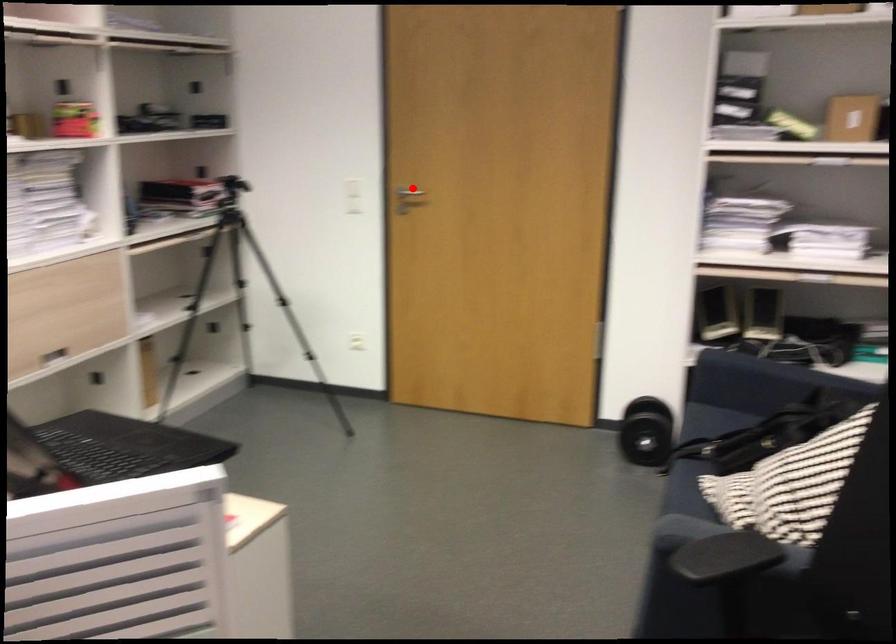
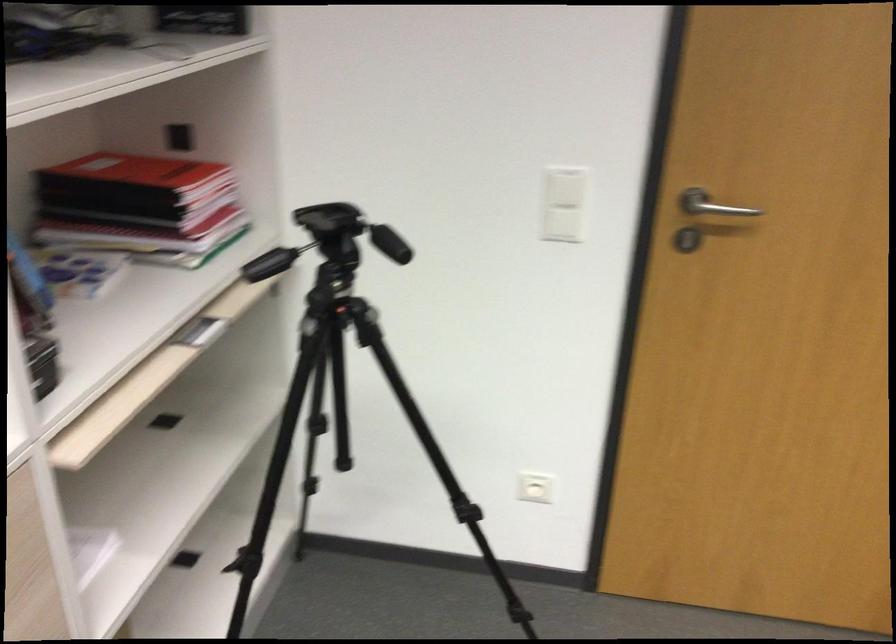
Where in the second image is the point corresponding to the highlighted location from the first image?

(711, 205)